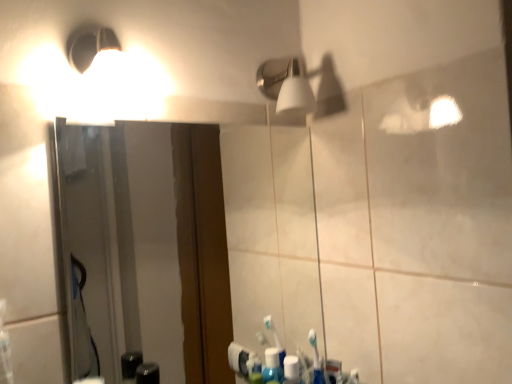
What is the approximate width of white matte light fixture at upper center?

white matte light fixture at upper center is 3.98 inches wide.

Locate an element on the screen. The height and width of the screenshot is (384, 512). white matte light fixture at upper center is located at coordinates (298, 87).

The image size is (512, 384). What do you see at coordinates (298, 87) in the screenshot?
I see `white matte light fixture at upper center` at bounding box center [298, 87].

The height and width of the screenshot is (384, 512). I want to click on clear glass mirror at center, so (149, 244).

This screenshot has width=512, height=384. What do you see at coordinates (149, 244) in the screenshot?
I see `clear glass mirror at center` at bounding box center [149, 244].

Measure the distance between point (173,258) and camera.

A distance of 1.98 meters exists between point (173,258) and camera.

I want to click on white matte light fixture at upper center, so click(x=298, y=87).

Between clear glass mirror at center and white matte light fixture at upper center, which one appears on the right side from the viewer's perspective?

white matte light fixture at upper center.

Which is behind, clear glass mirror at center or white matte light fixture at upper center?

Positioned behind is white matte light fixture at upper center.

Considering the positions of points (209, 197) and (300, 77), is point (209, 197) closer to camera compared to point (300, 77)?

No, it is not.

From the image's perspective, is clear glass mirror at center below white matte light fixture at upper center?

Indeed, from the image's perspective, clear glass mirror at center is shown beneath white matte light fixture at upper center.

From a real-world perspective, is clear glass mirror at center above or below white matte light fixture at upper center?

In terms of real-world spatial position, clear glass mirror at center is below white matte light fixture at upper center.

Looking at this image, considering the relative sizes of clear glass mirror at center and white matte light fixture at upper center in the image provided, is clear glass mirror at center wider than white matte light fixture at upper center?

Incorrect, the width of clear glass mirror at center does not surpass that of white matte light fixture at upper center.

Which of these two, clear glass mirror at center or white matte light fixture at upper center, stands taller?

clear glass mirror at center is taller.

Is clear glass mirror at center bigger than white matte light fixture at upper center?

Indeed, clear glass mirror at center has a larger size compared to white matte light fixture at upper center.

Choose the correct answer: Is clear glass mirror at center inside white matte light fixture at upper center or outside it?

clear glass mirror at center lies outside white matte light fixture at upper center.

Does clear glass mirror at center touch white matte light fixture at upper center?

No, clear glass mirror at center is not beside white matte light fixture at upper center.

Is clear glass mirror at center oriented away from white matte light fixture at upper center?

That's not correct — clear glass mirror at center is not looking away from white matte light fixture at upper center.

In the scene shown: What's the angular difference between clear glass mirror at center and white matte light fixture at upper center's facing directions?

clear glass mirror at center and white matte light fixture at upper center are facing 1.31 degrees away from each other.

Identify the location of mirror located below the white matte light fixture at upper center (from the image's perspective). (149, 244).

Is white matte light fixture at upper center at the right side of clear glass mirror at center?

Indeed, white matte light fixture at upper center is positioned on the right side of clear glass mirror at center.

Consider the image. Does white matte light fixture at upper center come in front of clear glass mirror at center?

No, white matte light fixture at upper center is behind clear glass mirror at center.

Is point (295, 87) farther from camera compared to point (181, 355)?

No, (295, 87) is in front of (181, 355).

From the image's perspective, is white matte light fixture at upper center above or below clear glass mirror at center?

Based on their image positions, white matte light fixture at upper center is located above clear glass mirror at center.

From a real-world perspective, which is physically below, white matte light fixture at upper center or clear glass mirror at center?

From a 3D spatial view, clear glass mirror at center is below.

Which of these two, white matte light fixture at upper center or clear glass mirror at center, is thinner?

Thinner between the two is clear glass mirror at center.

Does white matte light fixture at upper center have a greater height compared to clear glass mirror at center?

No.

Considering the sizes of white matte light fixture at upper center and clear glass mirror at center in the image, is white matte light fixture at upper center bigger or smaller than clear glass mirror at center?

white matte light fixture at upper center is smaller than clear glass mirror at center.

Is clear glass mirror at center inside white matte light fixture at upper center?

No, clear glass mirror at center is not a part of white matte light fixture at upper center.

Is white matte light fixture at upper center placed right next to clear glass mirror at center?

No, white matte light fixture at upper center is not beside clear glass mirror at center.

Is clear glass mirror at center at the back of white matte light fixture at upper center?

No, clear glass mirror at center is not at the back of white matte light fixture at upper center.

Locate an element on the screen. mirror on the left of white matte light fixture at upper center is located at coordinates (149, 244).

You are a GUI agent. You are given a task and a screenshot of the screen. Output one action in this format:
    pyautogui.click(x=<x>, y=<y>)
    Task: Click on the light fixture located above the clear glass mirror at center (from the image's perspective)
    This screenshot has width=512, height=384.
    Given the screenshot: What is the action you would take?
    pyautogui.click(x=298, y=87)

Image resolution: width=512 pixels, height=384 pixels. I want to click on light fixture above the clear glass mirror at center (from a real-world perspective), so click(x=298, y=87).